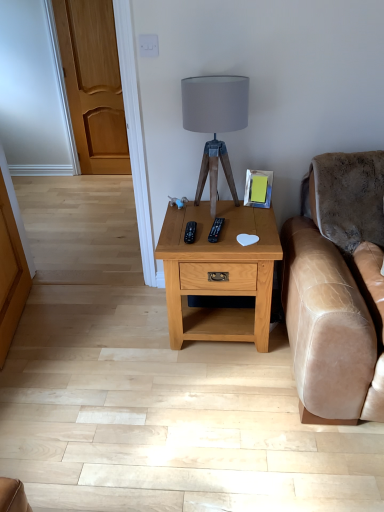
The image size is (384, 512). I want to click on vacant area in front of black plastic remote at center, the 2th remote from the left, so click(x=222, y=242).